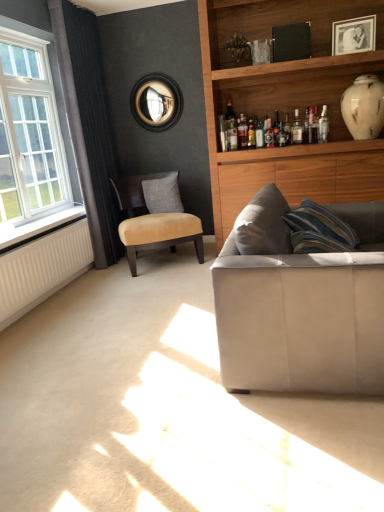
Question: Is white ribbed radiator at lower left facing away from white glossy vase at upper right?

Choices:
 (A) no
 (B) yes

Answer: (A)

Question: From the image's perspective, is white ribbed radiator at lower left below white glossy vase at upper right?

Choices:
 (A) no
 (B) yes

Answer: (B)

Question: Is white ribbed radiator at lower left facing towards white glossy vase at upper right?

Choices:
 (A) no
 (B) yes

Answer: (A)

Question: Is white glossy vase at upper right surrounded by white ribbed radiator at lower left?

Choices:
 (A) no
 (B) yes

Answer: (A)

Question: Does white ribbed radiator at lower left appear on the right side of white glossy vase at upper right?

Choices:
 (A) yes
 (B) no

Answer: (B)

Question: Considering the relative sizes of white ribbed radiator at lower left and white glossy vase at upper right in the image provided, is white ribbed radiator at lower left wider than white glossy vase at upper right?

Choices:
 (A) yes
 (B) no

Answer: (B)

Question: Does translucent glass bottle at upper center, arranged as the 2th bottle when viewed from the right, have a lesser width compared to gray fabric pillow at center?

Choices:
 (A) yes
 (B) no

Answer: (A)

Question: From the image's perspective, does translucent glass bottle at upper center, positioned as the first bottle in left-to-right order, appear higher than gray fabric pillow at center?

Choices:
 (A) yes
 (B) no

Answer: (A)

Question: Is translucent glass bottle at upper center, arranged as the 2th bottle when viewed from the right, to the left of gray fabric pillow at center from the viewer's perspective?

Choices:
 (A) no
 (B) yes

Answer: (A)

Question: Is translucent glass bottle at upper center, positioned as the first bottle in left-to-right order, shorter than gray fabric pillow at center?

Choices:
 (A) yes
 (B) no

Answer: (A)

Question: Is translucent glass bottle at upper center, positioned as the first bottle in left-to-right order, aimed at gray fabric pillow at center?

Choices:
 (A) yes
 (B) no

Answer: (B)

Question: Does translucent glass bottle at upper center, arranged as the 2th bottle when viewed from the right, appear on the right side of gray fabric pillow at center?

Choices:
 (A) no
 (B) yes

Answer: (B)

Question: Is the surface of suede-like beige couch at lower right in direct contact with white glossy vase at upper right?

Choices:
 (A) no
 (B) yes

Answer: (A)